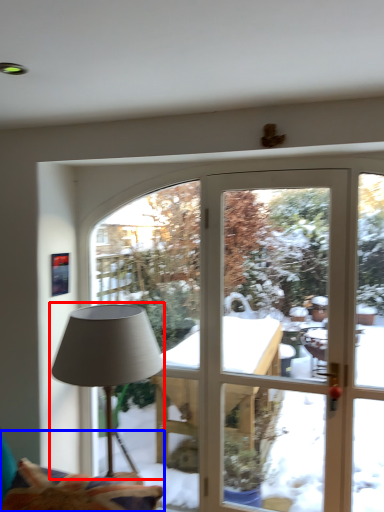
Question: Which point is closer to the camera, lamp (highlighted by a red box) or swivel chair (highlighted by a blue box)?

Choices:
 (A) lamp
 (B) swivel chair

Answer: (B)